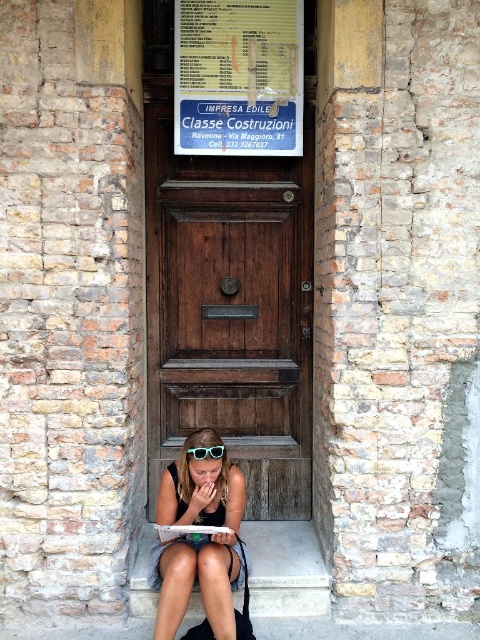
You are standing 3 meters away from the rustic brick wall with the wooden door. There is a point at coordinate (x=203, y=364) on the wall. Can you reach that point with a 1.5 meter long pole?

The distance of point (x=203, y=364) from viewer is 4.06 meters. Since you are standing 3 meters away, the total distance to the point is 3 meters plus 4.06 meters, totaling 7.06 meters. The pole is only 1.5 meters long, so you cannot reach the point with the pole.

You are standing in front of the wooden door at the center of the rustic brick wall and notice two items at the lower center of the image. Which item is nearer to you between the matte blue sunglasses at lower center and the smooth concrete stairs at lower center?

The matte blue sunglasses at lower center is closer to the viewer than the smooth concrete stairs at lower center.